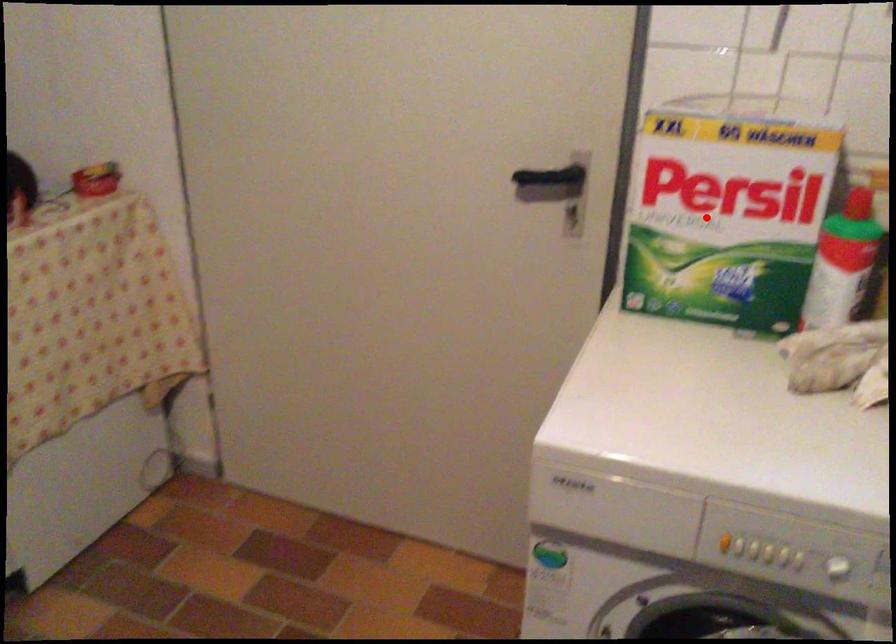
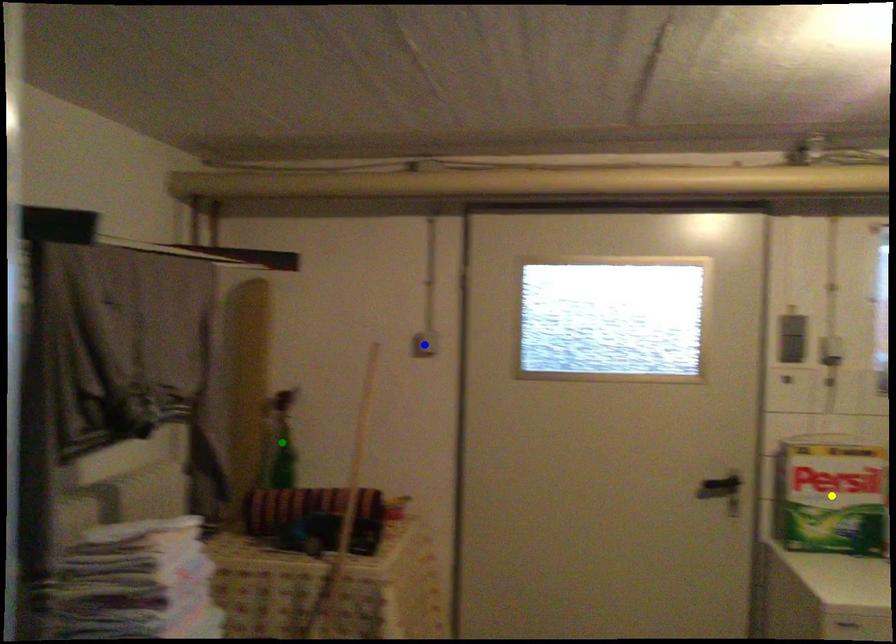
Question: I am providing you with two images of the same scene from different viewpoints. A red point is marked on the first image. You are given multiple points on the second image. Can you choose the point in image 2 that corresponds to the point in image 1?

Choices:
 (A) blue point
 (B) green point
 (C) yellow point

Answer: (C)